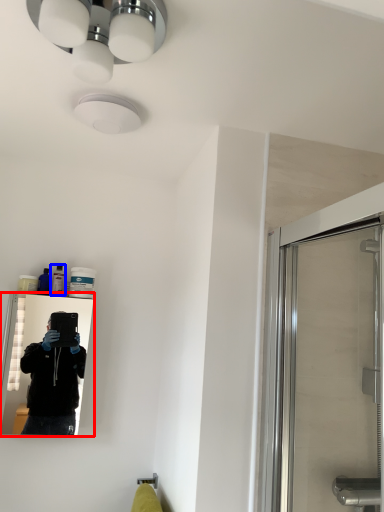
Question: Among these objects, which one is nearest to the camera, mirror (highlighted by a red box) or toiletry (highlighted by a blue box)?

Choices:
 (A) mirror
 (B) toiletry

Answer: (A)